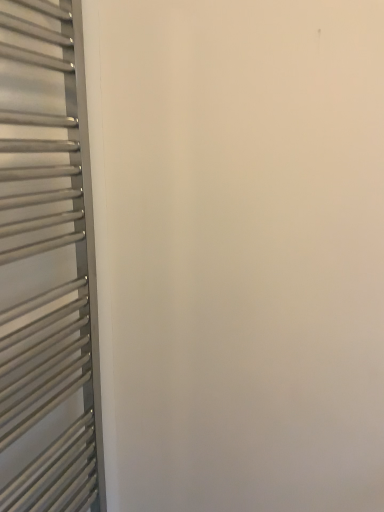
The image size is (384, 512). What do you see at coordinates (45, 269) in the screenshot?
I see `metallic silver blinds at left` at bounding box center [45, 269].

Where is `metallic silver blinds at left`? The image size is (384, 512). metallic silver blinds at left is located at coordinates (45, 269).

Image resolution: width=384 pixels, height=512 pixels. I want to click on metallic silver blinds at left, so click(x=45, y=269).